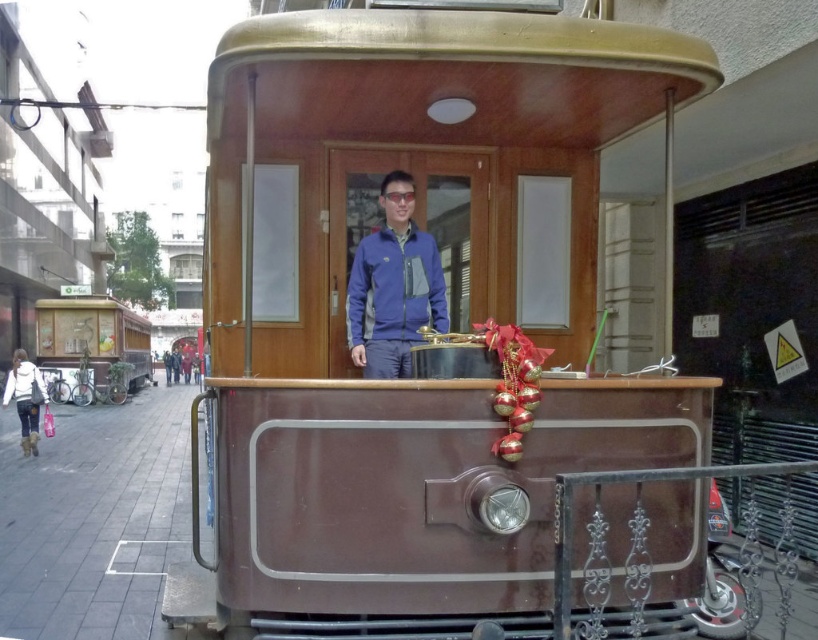
In the scene shown: Who is shorter, blue fleece jacket at center or wooden cart at left?

blue fleece jacket at center is shorter.

Does point (376, 314) come farther from viewer compared to point (133, 376)?

No.

This screenshot has width=818, height=640. I want to click on blue fleece jacket at center, so click(x=393, y=285).

Can you confirm if brown polished wood train at center is positioned to the right of blue fleece jacket at center?

Indeed, brown polished wood train at center is positioned on the right side of blue fleece jacket at center.

Can you confirm if brown polished wood train at center is shorter than blue fleece jacket at center?

In fact, brown polished wood train at center may be taller than blue fleece jacket at center.

Consider the image. Who is more distant from viewer, (342,216) or (401,170)?

The point (342,216) is behind.

Find the location of a particular element. The image size is (818, 640). brown polished wood train at center is located at coordinates (412, 314).

Does brown polished wood train at center have a larger size compared to wooden cart at left?

No, brown polished wood train at center is not bigger than wooden cart at left.

Which is in front, point (357, 58) or point (90, 356)?

Point (357, 58)

Which is behind, point (434, 477) or point (61, 360)?

Point (61, 360)

At what (x,y) coordinates should I click in order to perform the action: click on brown polished wood train at center. Please return your answer as a coordinate pair (x, y). The width and height of the screenshot is (818, 640). Looking at the image, I should click on (412, 314).